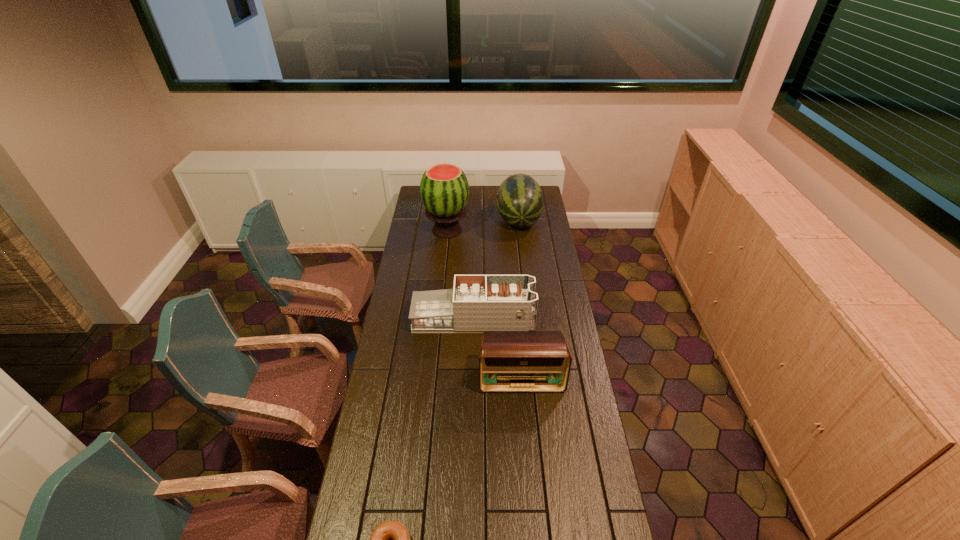
Where is `object at the far edge`? object at the far edge is located at coordinates (520, 200).

The height and width of the screenshot is (540, 960). In order to click on watermelon that is positioned at the left edge in this screenshot , I will do `click(444, 189)`.

Locate an element on the screen. dollhouse present at the left edge is located at coordinates (476, 303).

Locate an element on the screen. This screenshot has height=540, width=960. watermelon that is at the right edge is located at coordinates (520, 200).

This screenshot has width=960, height=540. What are the coordinates of `radio receiver that is at the right edge` in the screenshot? It's located at (510, 361).

Locate an element on the screen. The image size is (960, 540). object that is at the far right corner is located at coordinates (520, 200).

At what (x,y) coordinates should I click in order to perform the action: click on free point at the left edge. Please return your answer as a coordinate pair (x, y). The width and height of the screenshot is (960, 540). Looking at the image, I should click on (359, 455).

Where is `free space at the right edge of the desktop`? free space at the right edge of the desktop is located at coordinates click(533, 262).

This screenshot has height=540, width=960. Find the location of `vacant space at the far right corner of the desktop`. vacant space at the far right corner of the desktop is located at coordinates (542, 186).

Find the location of a particular element. This screenshot has height=540, width=960. free area in between the taller watermelon and the fourth shortest object is located at coordinates (483, 225).